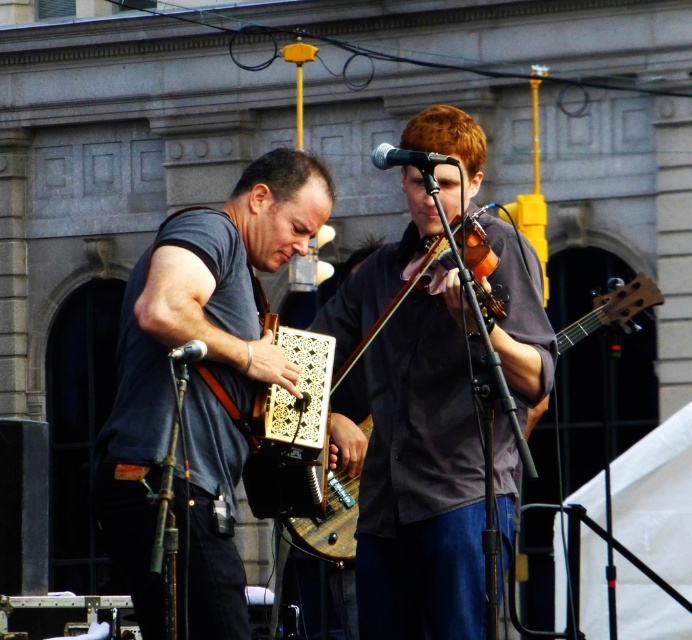
You are a photographer taking a picture of the two musicians. You want to ensure that the matte gray shirt at center and the gray matte accordion at center are both clearly visible in the frame. Based on their positions, which object should you focus on first to ensure both are in focus?

The gray matte accordion at center is to the left of the matte gray shirt at center. Since the shirt is to the right of the accordion, focusing on the object further away might help both be in focus. However, without knowing the exact distance, it is safer to focus on the midpoint between them or use a wide depth of field.

You are a photographer taking a picture of the scene. You want to ensure that both the matte gray shirt at center and the wooden acoustic guitar at center are clearly visible in your photo. Based on their positions, which one should you focus on first to ensure proper focus?

The matte gray shirt at center is below the wooden acoustic guitar at center, so you should focus on the wooden acoustic guitar at center first to ensure both are in focus.

You are a photographer standing at the camera position. You want to take a closeup photo of the gray matte accordion at center. Given that your camera has a maximum zoom range of 30 meters, can you capture the accordion clearly without moving closer?

The gray matte accordion at center is 37.31 meters away from camera. Since the maximum zoom range is 30 meters, the camera cannot capture the accordion clearly without moving closer because the distance exceeds the zoom capability.